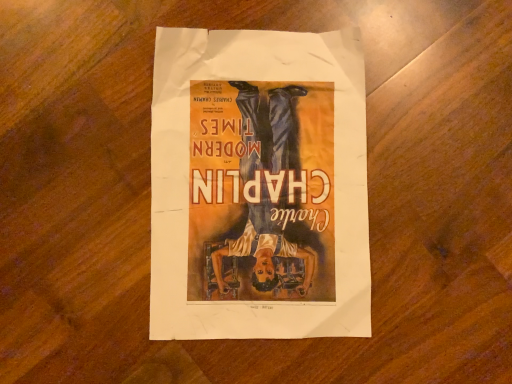
What is the approximate height of matte paper poster at center?

It is 0.77 inches.

Where is `matte paper poster at center`? The image size is (512, 384). matte paper poster at center is located at coordinates (259, 186).

Describe the element at coordinates (259, 186) in the screenshot. I see `matte paper poster at center` at that location.

Where is `matte paper poster at center`? matte paper poster at center is located at coordinates (259, 186).